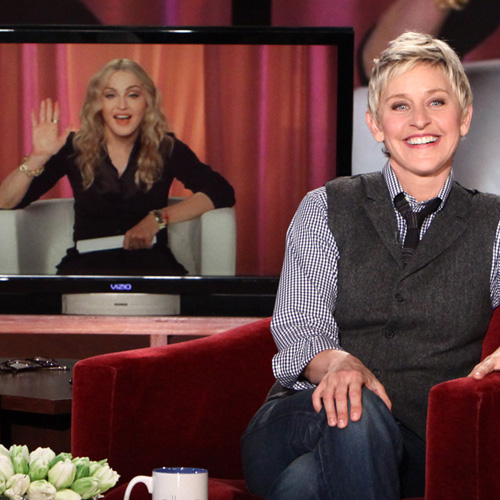
Find the location of a particular element. brown table is located at coordinates (40, 401).